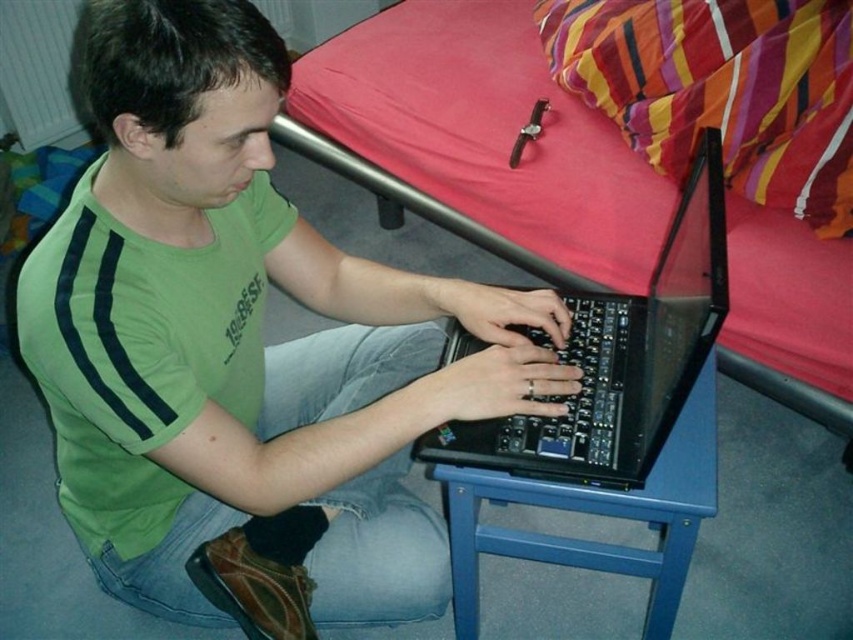
You are organizing a clothing donation drive and need to determine if the green fabric shirt at center can be placed on top of the blue plastic stool at lower center without falling off. Based on their sizes, is this possible?

The green fabric shirt at center has a larger size compared to blue plastic stool at lower center, so placing it on top might cause it to hang over the edges and potentially fall off unless secured.

You are helping to organize a small space. You need to place the green fabric shirt at center and the blue plastic stool at lower center side by side. Which object should you place first to ensure they fit without overlapping?

The blue plastic stool at lower center should be placed first since the green fabric shirt at center is wider, so positioning the smaller stool first allows proper arrangement without overlapping.